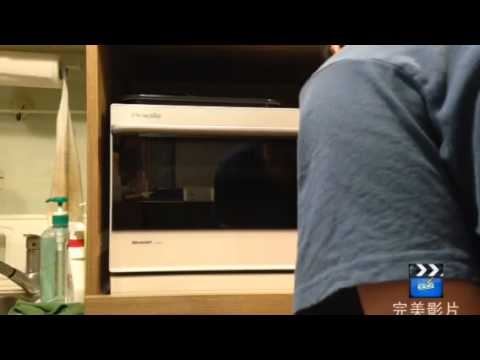
At what (x,y) coordinates should I click in order to perform the action: click on faucet. Please return your answer as a coordinate pair (x, y). Looking at the image, I should click on (12, 273).